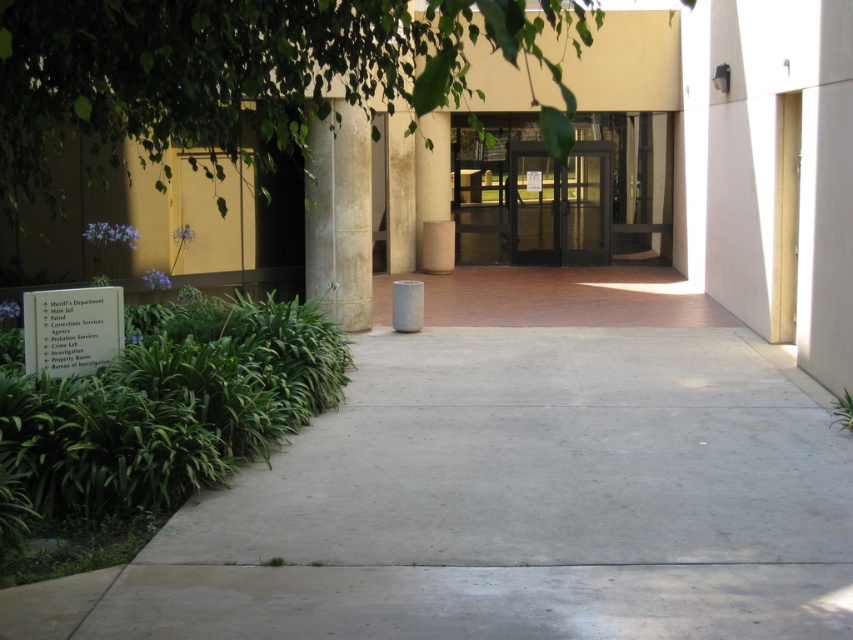
Looking at this image, is gray concrete pavement at center to the right of white stone pillar at center from the viewer's perspective?

Indeed, gray concrete pavement at center is positioned on the right side of white stone pillar at center.

Between point (735, 403) and point (340, 301), which one is positioned in front?

Point (735, 403) is more forward.

Which is in front, point (776, 579) or point (325, 292)?

Point (776, 579) is in front.

I want to click on gray concrete pavement at center, so click(x=509, y=502).

In the scene shown: Can you confirm if gray concrete pavement at center is positioned to the right of transparent glass doors at center?

No, gray concrete pavement at center is not to the right of transparent glass doors at center.

Who is taller, gray concrete pavement at center or transparent glass doors at center?

With more height is transparent glass doors at center.

Image resolution: width=853 pixels, height=640 pixels. In order to click on gray concrete pavement at center in this screenshot , I will do `click(509, 502)`.

Who is taller, gray concrete pavement at center or green leafy plant at lower right?

green leafy plant at lower right is taller.

Can you confirm if gray concrete pavement at center is positioned above green leafy plant at lower right?

No.

Where is `gray concrete pavement at center`? This screenshot has width=853, height=640. gray concrete pavement at center is located at coordinates (509, 502).